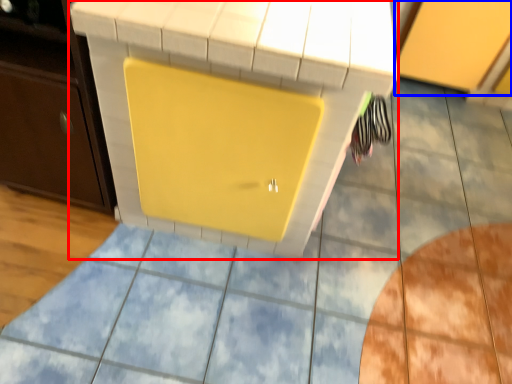
Question: Which object appears farthest to the camera in this image, vanity (highlighted by a red box) or cabinetry (highlighted by a blue box)?

Choices:
 (A) vanity
 (B) cabinetry

Answer: (B)